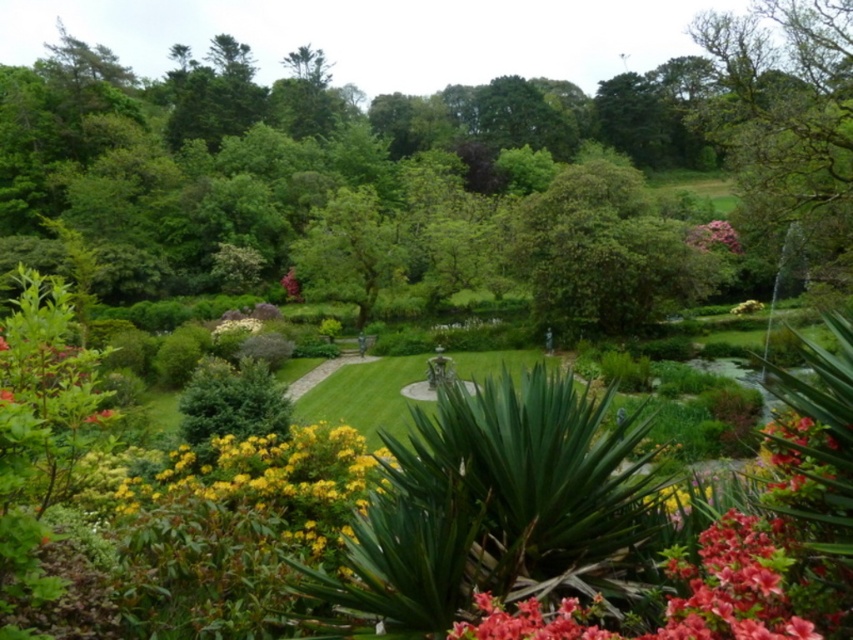
Is point (749, 113) positioned in front of point (753, 307)?

Yes, point (749, 113) is closer to viewer.

Which is below, green mossy tree at upper right or yellow matte flower at center?

yellow matte flower at center

Where is `green mossy tree at upper right`? The image size is (853, 640). green mossy tree at upper right is located at coordinates (x=788, y=120).

Find the location of a particular element. green mossy tree at upper right is located at coordinates (788, 120).

Does vivid red petals at lower right appear under yellow matte flowers at center?

Actually, vivid red petals at lower right is above yellow matte flowers at center.

Which is in front, point (701, 628) or point (223, 497)?

Point (701, 628)

Which is in front, point (825, 568) or point (265, 477)?

Point (825, 568)

Locate an element on the screen. The height and width of the screenshot is (640, 853). vivid red petals at lower right is located at coordinates (757, 582).

Who is positioned more to the left, vivid red petals at lower right or pink matte flower at upper right?

From the viewer's perspective, vivid red petals at lower right appears more on the left side.

Which is behind, point (453, 627) or point (706, 241)?

The point (706, 241) is more distant.

Locate an element on the screen. The height and width of the screenshot is (640, 853). vivid red petals at lower right is located at coordinates (757, 582).